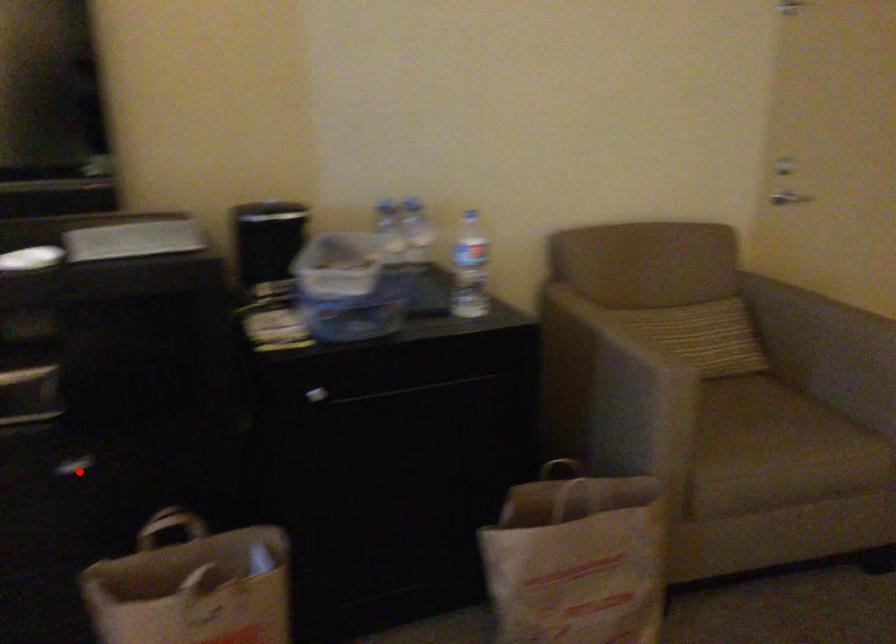
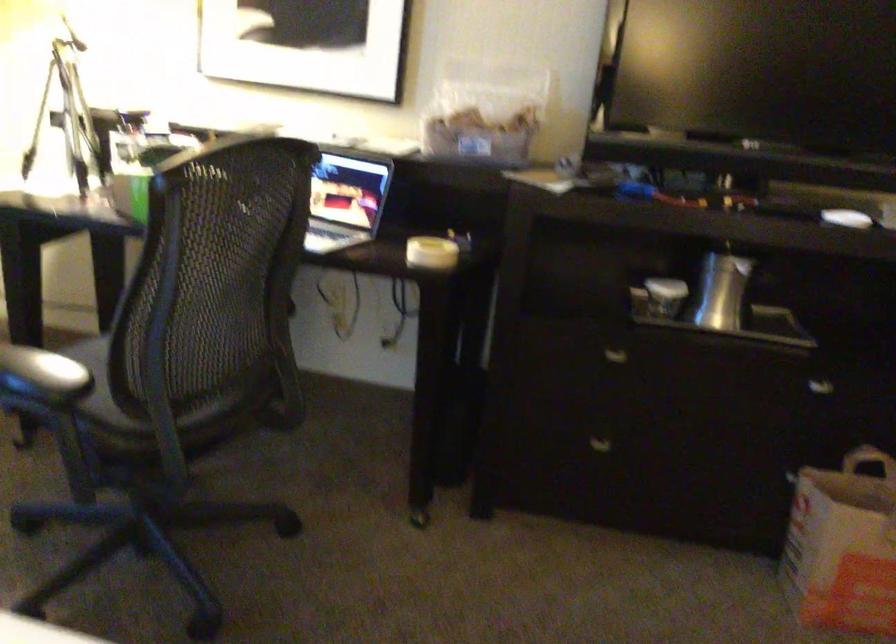
Question: I am providing you with two images of the same scene from different viewpoints. A red point is shown in image1. For the corresponding object point in image2, is it positioned nearer or farther from the camera?

Choices:
 (A) Nearer
 (B) Farther

Answer: (B)